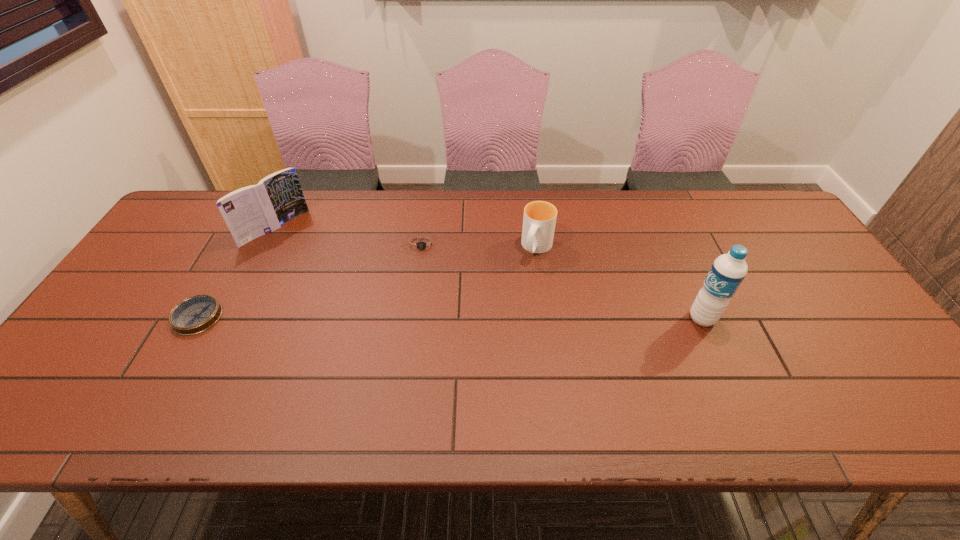
Locate an element on the screen. The height and width of the screenshot is (540, 960). watch present at the far edge is located at coordinates (423, 244).

The width and height of the screenshot is (960, 540). I want to click on cup that is at the far edge, so click(539, 220).

At what (x,y) coordinates should I click in order to perform the action: click on book positioned at the far edge. Please return your answer as a coordinate pair (x, y). The width and height of the screenshot is (960, 540). Looking at the image, I should click on (252, 211).

I want to click on vacant space at the far edge of the desktop, so click(306, 212).

At what (x,y) coordinates should I click in order to perform the action: click on free space at the near edge. Please return your answer as a coordinate pair (x, y). Image resolution: width=960 pixels, height=540 pixels. Looking at the image, I should click on (278, 367).

This screenshot has height=540, width=960. In the image, there is a desktop. Find the location of `vacant space at the left edge`. vacant space at the left edge is located at coordinates (164, 240).

Where is `vacant space at the right edge of the desktop`? vacant space at the right edge of the desktop is located at coordinates (764, 241).

Where is `vacant space at the far right corner`? This screenshot has width=960, height=540. vacant space at the far right corner is located at coordinates (777, 217).

You are a GUI agent. You are given a task and a screenshot of the screen. Output one action in this format:
    pyautogui.click(x=<x>, y=<y>)
    Task: Click on the unoccupied area between the cup and the tallest object
    The image size is (960, 540).
    Given the screenshot: What is the action you would take?
    pyautogui.click(x=620, y=283)

At what (x,y) coordinates should I click in order to perform the action: click on blank region between the third object from right to left and the shortest object. Please return your answer as a coordinate pair (x, y). The image size is (960, 540). Looking at the image, I should click on (310, 281).